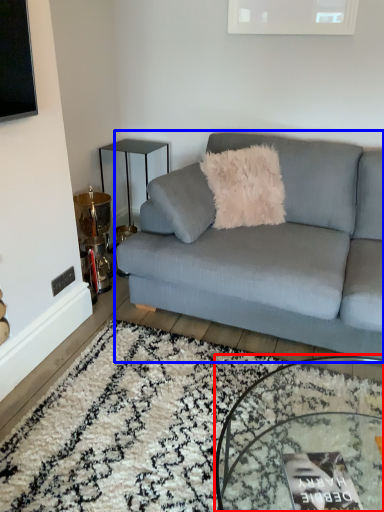
Question: Which object appears farthest to the camera in this image, coffee table (highlighted by a red box) or studio couch (highlighted by a blue box)?

Choices:
 (A) coffee table
 (B) studio couch

Answer: (B)